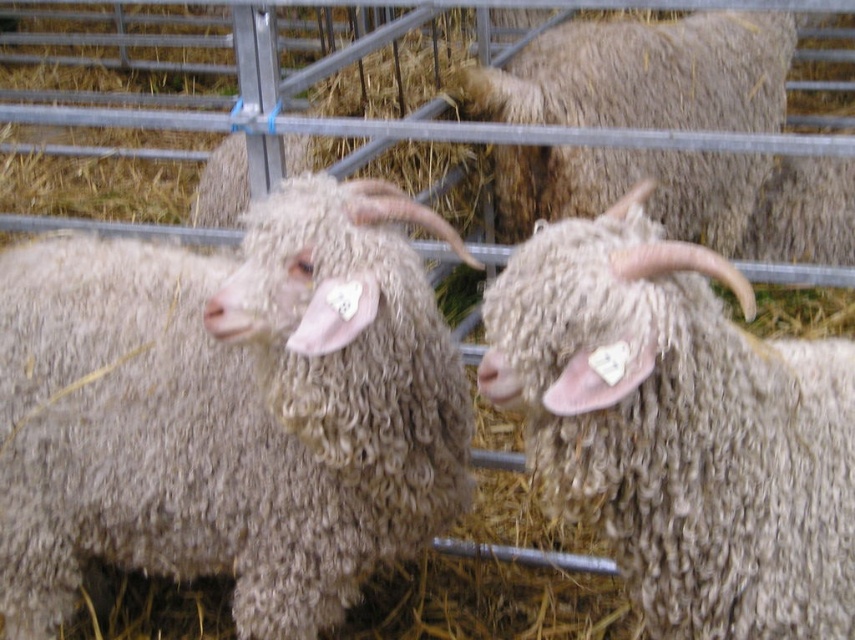
Between point (659, 451) and point (612, 173), which one is positioned in front?

Point (659, 451) is in front.

Is point (634, 406) closer to viewer compared to point (513, 182)?

Yes, point (634, 406) is closer to viewer.

The width and height of the screenshot is (855, 640). In order to click on fuzzy woolen sheep at center in this screenshot , I will do `click(679, 428)`.

Which of these two, curly woolen sheep at center or fluffy woolen sheep at upper right, stands shorter?

curly woolen sheep at center is shorter.

Between point (361, 445) and point (787, 45), which one is positioned behind?

Positioned behind is point (787, 45).

The image size is (855, 640). Describe the element at coordinates (228, 410) in the screenshot. I see `curly woolen sheep at center` at that location.

Where is `curly woolen sheep at center`? The height and width of the screenshot is (640, 855). curly woolen sheep at center is located at coordinates click(x=228, y=410).

Can you confirm if curly woolen sheep at center is thinner than fuzzy woolen sheep at center?

No.

Is curly woolen sheep at center smaller than fuzzy woolen sheep at center?

No, curly woolen sheep at center is not smaller than fuzzy woolen sheep at center.

Is point (31, 358) positioned behind point (823, 358)?

Yes, it is.

Locate an element on the screen. curly woolen sheep at center is located at coordinates (228, 410).